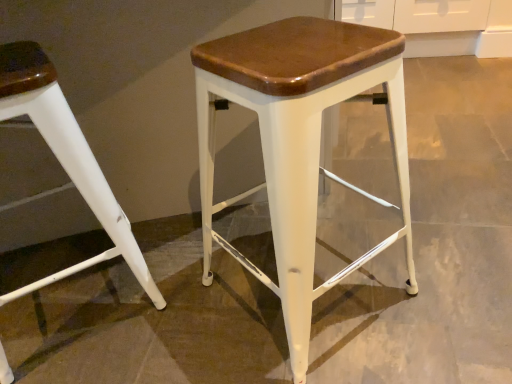
Find the location of a particular element. The height and width of the screenshot is (384, 512). matte white stool at center, which ranks as the second stool in left-to-right order is located at coordinates click(298, 142).

Describe the element at coordinates (298, 142) in the screenshot. I see `matte white stool at center, acting as the first stool starting from the right` at that location.

I want to click on white matte stool at left, marked as the second stool in a right-to-left arrangement, so click(66, 158).

Image resolution: width=512 pixels, height=384 pixels. What do you see at coordinates (66, 158) in the screenshot?
I see `white matte stool at left, which is counted as the first stool, starting from the left` at bounding box center [66, 158].

The image size is (512, 384). What are the coordinates of `matte white stool at center, which ranks as the second stool in left-to-right order` in the screenshot? It's located at (298, 142).

Is white matte stool at left, marked as the second stool in a right-to-left arrangement, to the left or to the right of matte white stool at center, acting as the first stool starting from the right, in the image?

white matte stool at left, marked as the second stool in a right-to-left arrangement, is positioned on matte white stool at center, acting as the first stool starting from the right,'s left side.

Considering their positions, is white matte stool at left, marked as the second stool in a right-to-left arrangement, located in front of or behind matte white stool at center, acting as the first stool starting from the right?

Visually, white matte stool at left, marked as the second stool in a right-to-left arrangement, is located behind matte white stool at center, acting as the first stool starting from the right.

Is point (50, 110) closer or farther from the camera than point (281, 109)?

Point (50, 110) is positioned farther from the camera compared to point (281, 109).

From the image's perspective, is white matte stool at left, marked as the second stool in a right-to-left arrangement, above matte white stool at center, which ranks as the second stool in left-to-right order?

Incorrect, from the image's perspective, white matte stool at left, marked as the second stool in a right-to-left arrangement, is lower than matte white stool at center, which ranks as the second stool in left-to-right order.

From a real-world perspective, is white matte stool at left, marked as the second stool in a right-to-left arrangement, over matte white stool at center, which ranks as the second stool in left-to-right order?

No, from a real-world perspective, white matte stool at left, marked as the second stool in a right-to-left arrangement, is not above matte white stool at center, which ranks as the second stool in left-to-right order.

Which object is wider, white matte stool at left, marked as the second stool in a right-to-left arrangement, or matte white stool at center, acting as the first stool starting from the right?

Wider between the two is white matte stool at left, marked as the second stool in a right-to-left arrangement.

Who is shorter, white matte stool at left, which is counted as the first stool, starting from the left, or matte white stool at center, acting as the first stool starting from the right?

With less height is white matte stool at left, which is counted as the first stool, starting from the left.

Can you confirm if white matte stool at left, which is counted as the first stool, starting from the left, is bigger than matte white stool at center, acting as the first stool starting from the right?

Indeed, white matte stool at left, which is counted as the first stool, starting from the left, has a larger size compared to matte white stool at center, acting as the first stool starting from the right.

Could matte white stool at center, acting as the first stool starting from the right, be considered to be inside white matte stool at left, marked as the second stool in a right-to-left arrangement?

Actually, matte white stool at center, acting as the first stool starting from the right, is outside white matte stool at left, marked as the second stool in a right-to-left arrangement.

Is white matte stool at left, which is counted as the first stool, starting from the left, next to matte white stool at center, acting as the first stool starting from the right, and touching it?

No, white matte stool at left, which is counted as the first stool, starting from the left, is not beside matte white stool at center, acting as the first stool starting from the right.

Is white matte stool at left, which is counted as the first stool, starting from the left, oriented towards matte white stool at center, acting as the first stool starting from the right?

No, white matte stool at left, which is counted as the first stool, starting from the left, is not turned towards matte white stool at center, acting as the first stool starting from the right.

In order to click on stool on the right of white matte stool at left, which is counted as the first stool, starting from the left in this screenshot , I will do `click(298, 142)`.

Considering the positions of objects matte white stool at center, which ranks as the second stool in left-to-right order, and white matte stool at left, marked as the second stool in a right-to-left arrangement, in the image provided, who is more to the right, matte white stool at center, which ranks as the second stool in left-to-right order, or white matte stool at left, marked as the second stool in a right-to-left arrangement,?

matte white stool at center, which ranks as the second stool in left-to-right order, is more to the right.

Relative to white matte stool at left, marked as the second stool in a right-to-left arrangement, is matte white stool at center, which ranks as the second stool in left-to-right order, in front or behind?

matte white stool at center, which ranks as the second stool in left-to-right order, is in front of white matte stool at left, marked as the second stool in a right-to-left arrangement.

Which is behind, point (231, 88) or point (7, 61)?

Point (7, 61)

From the image's perspective, which one is positioned higher, matte white stool at center, which ranks as the second stool in left-to-right order, or white matte stool at left, marked as the second stool in a right-to-left arrangement?

matte white stool at center, which ranks as the second stool in left-to-right order.

From a real-world perspective, is matte white stool at center, which ranks as the second stool in left-to-right order, below white matte stool at left, marked as the second stool in a right-to-left arrangement?

Incorrect, from a real-world perspective, matte white stool at center, which ranks as the second stool in left-to-right order, is higher than white matte stool at left, marked as the second stool in a right-to-left arrangement.

Which of these two, matte white stool at center, which ranks as the second stool in left-to-right order, or white matte stool at left, which is counted as the first stool, starting from the left, is thinner?

matte white stool at center, which ranks as the second stool in left-to-right order, is thinner.

Is matte white stool at center, which ranks as the second stool in left-to-right order, shorter than white matte stool at left, marked as the second stool in a right-to-left arrangement?

Incorrect, the height of matte white stool at center, which ranks as the second stool in left-to-right order, does not fall short of that of white matte stool at left, marked as the second stool in a right-to-left arrangement.

Considering the sizes of objects matte white stool at center, which ranks as the second stool in left-to-right order, and white matte stool at left, marked as the second stool in a right-to-left arrangement, in the image provided, who is smaller, matte white stool at center, which ranks as the second stool in left-to-right order, or white matte stool at left, marked as the second stool in a right-to-left arrangement,?

With smaller size is matte white stool at center, which ranks as the second stool in left-to-right order.

Would you say matte white stool at center, acting as the first stool starting from the right, is outside white matte stool at left, marked as the second stool in a right-to-left arrangement?

Yes, matte white stool at center, acting as the first stool starting from the right, is located beyond the bounds of white matte stool at left, marked as the second stool in a right-to-left arrangement.

Is matte white stool at center, which ranks as the second stool in left-to-right order, next to white matte stool at left, which is counted as the first stool, starting from the left?

They are not placed beside each other.

Is matte white stool at center, which ranks as the second stool in left-to-right order, looking in the opposite direction of white matte stool at left, marked as the second stool in a right-to-left arrangement?

matte white stool at center, which ranks as the second stool in left-to-right order, does not have its back to white matte stool at left, marked as the second stool in a right-to-left arrangement.

How many degrees apart are the facing directions of matte white stool at center, which ranks as the second stool in left-to-right order, and white matte stool at left, marked as the second stool in a right-to-left arrangement?

The angular difference between matte white stool at center, which ranks as the second stool in left-to-right order, and white matte stool at left, marked as the second stool in a right-to-left arrangement, is 6.12 degrees.

The image size is (512, 384). Find the location of `stool above the white matte stool at left, which is counted as the first stool, starting from the left (from a real-world perspective)`. stool above the white matte stool at left, which is counted as the first stool, starting from the left (from a real-world perspective) is located at coordinates (298, 142).

Locate an element on the screen. This screenshot has width=512, height=384. stool above the white matte stool at left, which is counted as the first stool, starting from the left (from a real-world perspective) is located at coordinates (298, 142).

What are the coordinates of `stool behind the matte white stool at center, which ranks as the second stool in left-to-right order` in the screenshot? It's located at (66, 158).